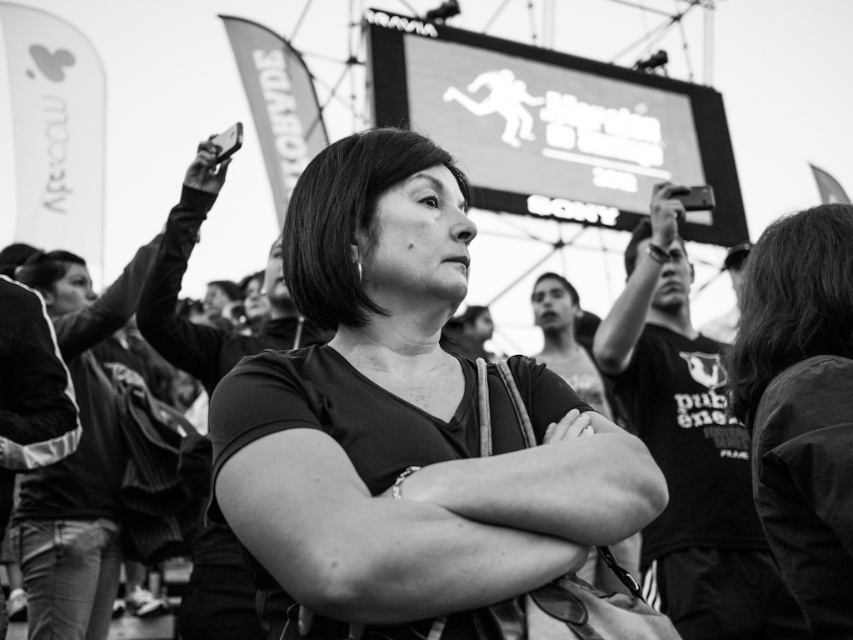
Question: Which point is closer to the camera taking this photo?

Choices:
 (A) (210, 173)
 (B) (434, 600)
 (C) (788, 509)

Answer: (B)

Question: Is smooth black shirt at center thinner than metallic silver camera at upper center?

Choices:
 (A) no
 (B) yes

Answer: (A)

Question: Among these objects, which one is nearest to the camera?

Choices:
 (A) smooth black jacket at center
 (B) smooth black shirt at center

Answer: (B)

Question: Is smooth black shirt at center further to the viewer compared to metallic silver camera at upper center?

Choices:
 (A) yes
 (B) no

Answer: (B)

Question: Is smooth black shirt at center to the left of metallic silver camera at upper center from the viewer's perspective?

Choices:
 (A) yes
 (B) no

Answer: (A)

Question: Which object is farther from the camera taking this photo?

Choices:
 (A) metallic silver phone at upper left
 (B) smooth black jacket at center

Answer: (A)